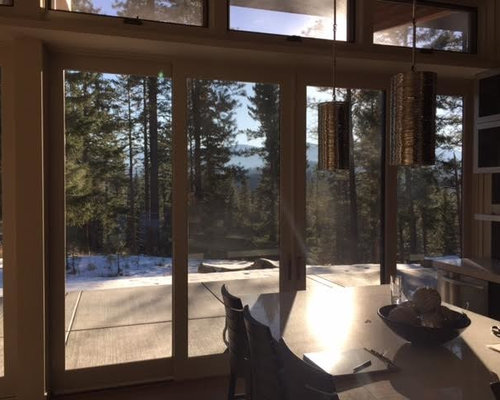
Locate an element on the screen. The width and height of the screenshot is (500, 400). door is located at coordinates (234, 145), (350, 198).